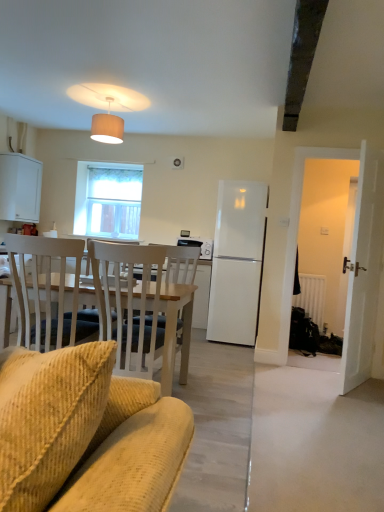
Question: From the image's perspective, is wooden chair at left located beneath beige ribbed lampshade at upper center?

Choices:
 (A) yes
 (B) no

Answer: (A)

Question: From a real-world perspective, is wooden chair at left physically below beige ribbed lampshade at upper center?

Choices:
 (A) no
 (B) yes

Answer: (B)

Question: Considering the relative sizes of wooden chair at left and beige ribbed lampshade at upper center in the image provided, is wooden chair at left smaller than beige ribbed lampshade at upper center?

Choices:
 (A) yes
 (B) no

Answer: (B)

Question: Considering the relative sizes of wooden chair at left and beige ribbed lampshade at upper center in the image provided, is wooden chair at left shorter than beige ribbed lampshade at upper center?

Choices:
 (A) no
 (B) yes

Answer: (A)

Question: Is beige ribbed lampshade at upper center inside wooden chair at left?

Choices:
 (A) yes
 (B) no

Answer: (B)

Question: In terms of size, does satin black microwave at center appear bigger or smaller than white matte cabinet at left?

Choices:
 (A) big
 (B) small

Answer: (B)

Question: In the image, is satin black microwave at center positioned in front of or behind white matte cabinet at left?

Choices:
 (A) behind
 (B) front

Answer: (B)

Question: Is satin black microwave at center wider or thinner than white matte cabinet at left?

Choices:
 (A) wide
 (B) thin

Answer: (B)

Question: Considering the positions of point (192, 238) and point (38, 180), is point (192, 238) closer or farther from the camera than point (38, 180)?

Choices:
 (A) closer
 (B) farther

Answer: (A)

Question: Visually, is beige ribbed lampshade at upper center positioned to the left or to the right of white matte radiator at right?

Choices:
 (A) right
 (B) left

Answer: (B)

Question: Relative to white matte radiator at right, is beige ribbed lampshade at upper center in front or behind?

Choices:
 (A) front
 (B) behind

Answer: (A)

Question: Is beige ribbed lampshade at upper center wider or thinner than white matte radiator at right?

Choices:
 (A) wide
 (B) thin

Answer: (A)

Question: From a real-world perspective, relative to white matte radiator at right, is beige ribbed lampshade at upper center vertically above or below?

Choices:
 (A) above
 (B) below

Answer: (A)

Question: Considering the positions of beige ribbed lampshade at upper center and satin black microwave at center in the image, is beige ribbed lampshade at upper center taller or shorter than satin black microwave at center?

Choices:
 (A) short
 (B) tall

Answer: (B)

Question: Is beige ribbed lampshade at upper center wider or thinner than satin black microwave at center?

Choices:
 (A) thin
 (B) wide

Answer: (B)